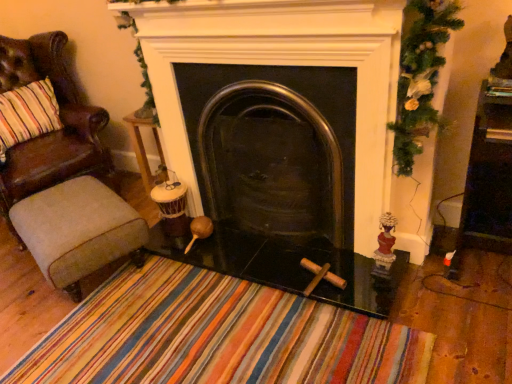
The image size is (512, 384). Describe the element at coordinates (420, 76) in the screenshot. I see `green textured garland at upper right` at that location.

This screenshot has height=384, width=512. What do you see at coordinates (143, 144) in the screenshot?
I see `wooden side table at center` at bounding box center [143, 144].

Image resolution: width=512 pixels, height=384 pixels. What do you see at coordinates (274, 148) in the screenshot? I see `black glass fireplace at center` at bounding box center [274, 148].

The height and width of the screenshot is (384, 512). What are the coordinates of `transparent glass table at center` in the screenshot? It's located at (288, 266).

What do you see at coordinates (52, 132) in the screenshot? I see `brown leather chair at left` at bounding box center [52, 132].

Find the location of a particular element. The height and width of the screenshot is (384, 512). green textured garland at upper right is located at coordinates (420, 76).

Considering the relative positions of brown leather chair at left and black glass fireplace at center in the image provided, is brown leather chair at left to the left or to the right of black glass fireplace at center?

brown leather chair at left is to the left of black glass fireplace at center.

Is brown leather chair at left aimed at black glass fireplace at center?

Yes, brown leather chair at left is aimed at black glass fireplace at center.

Consider the image. Which of these two, brown leather chair at left or black glass fireplace at center, is wider?

brown leather chair at left.

From the image's perspective, is transparent glass table at center above or below green textured garland at upper right?

Clearly, from the image's perspective, transparent glass table at center is below green textured garland at upper right.

From a real-world perspective, which object stands above the other?

From a 3D spatial view, green textured garland at upper right is above.

Would you say green textured garland at upper right is part of transparent glass table at center's contents?

No, green textured garland at upper right is not surrounded by transparent glass table at center.

From the image's perspective, is matte red figurine at right below black glass fireplace at center?

Yes, from the image's perspective, matte red figurine at right is below black glass fireplace at center.

Is matte red figurine at right with black glass fireplace at center?

They are not placed beside each other.

Considering the relative positions of matte red figurine at right and black glass fireplace at center in the image provided, is matte red figurine at right to the left or to the right of black glass fireplace at center?

Based on their positions, matte red figurine at right is located to the right of black glass fireplace at center.

Between matte red figurine at right and black glass fireplace at center, which one is positioned behind?

matte red figurine at right is behind.

From the image's perspective, relative to wooden side table at center, is beige fabric stool at lower left above or below?

beige fabric stool at lower left is below wooden side table at center.

Does point (29, 221) appear closer or farther from the camera than point (150, 126)?

Point (29, 221) is closer to the camera than point (150, 126).

From a real-world perspective, is beige fabric stool at lower left beneath wooden side table at center?

Yes, from a real-world perspective, beige fabric stool at lower left is under wooden side table at center.

Where is `chair on the left of matte red figurine at right`? This screenshot has height=384, width=512. chair on the left of matte red figurine at right is located at coordinates (52, 132).

Which point is more forward, (52,177) or (391,213)?

The point (391,213) is more forward.

Is brown leather chair at left at the right side of matte red figurine at right?

In fact, brown leather chair at left is to the left of matte red figurine at right.

Does brown leather chair at left turn towards matte red figurine at right?

Yes.

How many degrees apart are the facing directions of transparent glass table at center and beige fabric stool at lower left?

They differ by 68.6 degrees in their facing directions.

Does transparent glass table at center appear on the left side of beige fabric stool at lower left?

No, transparent glass table at center is not to the left of beige fabric stool at lower left.

Is beige fabric stool at lower left surrounded by transparent glass table at center?

Definitely not — beige fabric stool at lower left is not inside transparent glass table at center.

Can you confirm if transparent glass table at center is taller than beige fabric stool at lower left?

In fact, transparent glass table at center may be shorter than beige fabric stool at lower left.

Between green textured garland at upper right and black glass fireplace at center, which one has smaller size?

green textured garland at upper right.

Which point is more forward, (x=436, y=65) or (x=216, y=185)?

Point (x=436, y=65)

Is green textured garland at upper right far from black glass fireplace at center?

They are positioned close to each other.

Considering the sizes of objects green textured garland at upper right and black glass fireplace at center in the image provided, who is wider, green textured garland at upper right or black glass fireplace at center?

black glass fireplace at center is wider.

This screenshot has height=384, width=512. There is a black glass fireplace at center. In order to click on chair above it (from a real-world perspective) in this screenshot , I will do `click(52, 132)`.

This screenshot has height=384, width=512. What are the coordinates of `glass table directly beneath the green textured garland at upper right (from a real-world perspective)` in the screenshot? It's located at (288, 266).

Considering their positions, is matte red figurine at right positioned further to wooden side table at center than black glass fireplace at center?

Among the two, matte red figurine at right is located further to wooden side table at center.

In the scene shown: Estimate the real-world distances between objects in this image. Which object is closer to green textured garland at upper right, transparent glass table at center or matte red figurine at right?

matte red figurine at right lies closer to green textured garland at upper right than the other object.

Looking at this image, considering their positions, is transparent glass table at center positioned closer to brown leather chair at left than beige fabric stool at lower left?

beige fabric stool at lower left is positioned closer to the anchor brown leather chair at left.

Estimate the real-world distances between objects in this image. Which object is further from wooden side table at center, brown leather chair at left or black glass fireplace at center?

Based on the image, black glass fireplace at center appears to be further to wooden side table at center.

When comparing their distances from brown leather chair at left, does black glass fireplace at center or green textured garland at upper right seem closer?

black glass fireplace at center.

From the image, which object appears to be nearer to brown leather chair at left, transparent glass table at center or green textured garland at upper right?

transparent glass table at center is closer to brown leather chair at left.

When comparing their distances from matte red figurine at right, does wooden side table at center or green textured garland at upper right seem further?

wooden side table at center is positioned further to the anchor matte red figurine at right.

Based on their spatial positions, is brown leather chair at left or matte red figurine at right further from wooden side table at center?

matte red figurine at right.

Where is `toy between green textured garland at upper right and transparent glass table at center from top to bottom`? The width and height of the screenshot is (512, 384). toy between green textured garland at upper right and transparent glass table at center from top to bottom is located at coordinates (385, 247).

The height and width of the screenshot is (384, 512). I want to click on stool between brown leather chair at left and transparent glass table at center from left to right, so click(78, 230).

Find the location of `fireplace situated between wooden side table at center and matte red figurine at right from left to right`. fireplace situated between wooden side table at center and matte red figurine at right from left to right is located at coordinates (274, 148).

The width and height of the screenshot is (512, 384). I want to click on glass table located between beige fabric stool at lower left and matte red figurine at right in the left-right direction, so click(x=288, y=266).